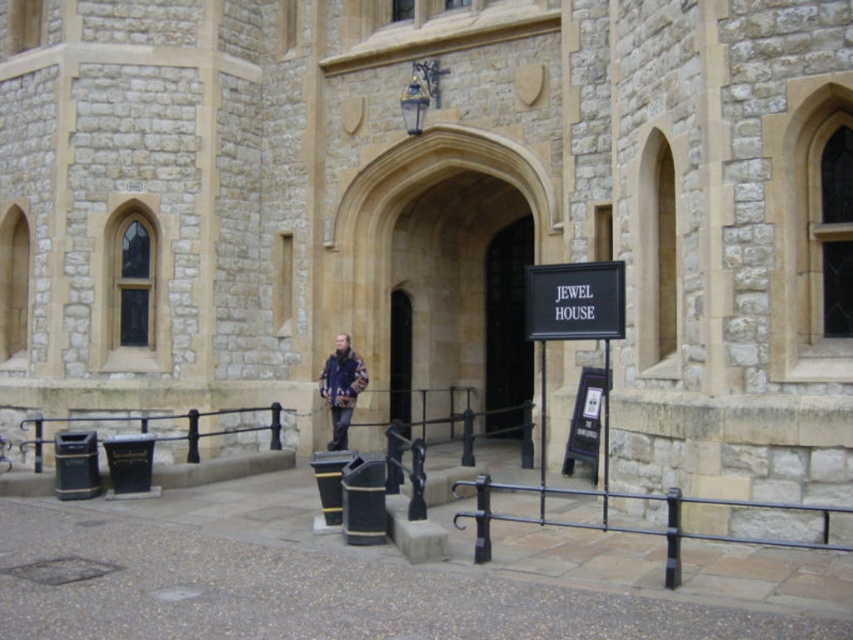
Question: Which object is positioned farthest from the black matte sign at center?

Choices:
 (A) dark stone archway at center
 (B) flannel jacket at center
 (C) smooth stone archway at center

Answer: (A)

Question: Considering the real-world distances, which object is closest to the smooth stone archway at center?

Choices:
 (A) black matte sign at center
 (B) dark stone archway at center
 (C) flannel jacket at center

Answer: (B)

Question: Is black matte sign at center behind smooth stone archway at center?

Choices:
 (A) no
 (B) yes

Answer: (A)

Question: Does dark stone archway at center have a lesser width compared to black matte sign at center?

Choices:
 (A) yes
 (B) no

Answer: (B)

Question: Is black matte sign at center below flannel jacket at center?

Choices:
 (A) yes
 (B) no

Answer: (B)

Question: Which point appears farthest from the camera in this image?

Choices:
 (A) (396, 355)
 (B) (347, 365)
 (C) (583, 304)
 (D) (505, 346)

Answer: (D)